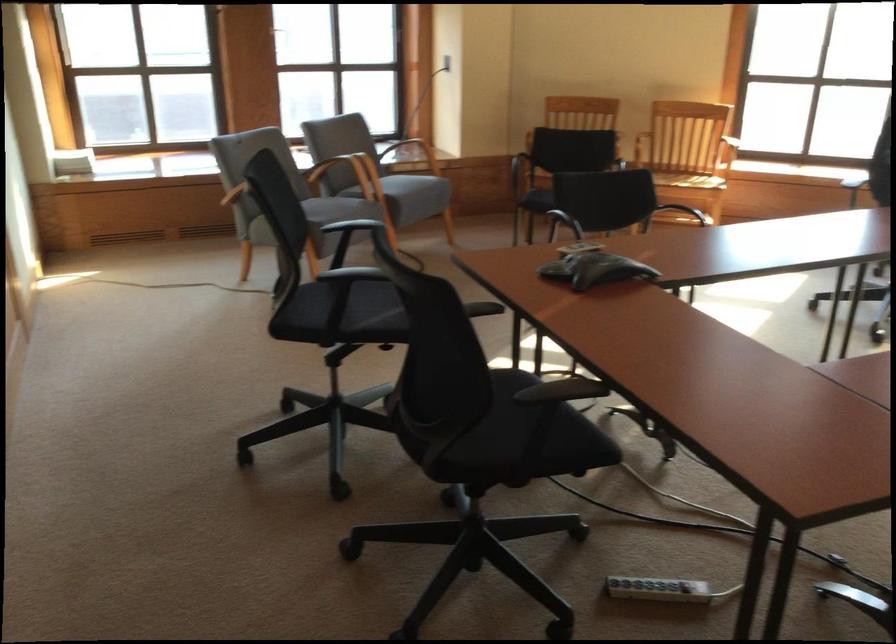
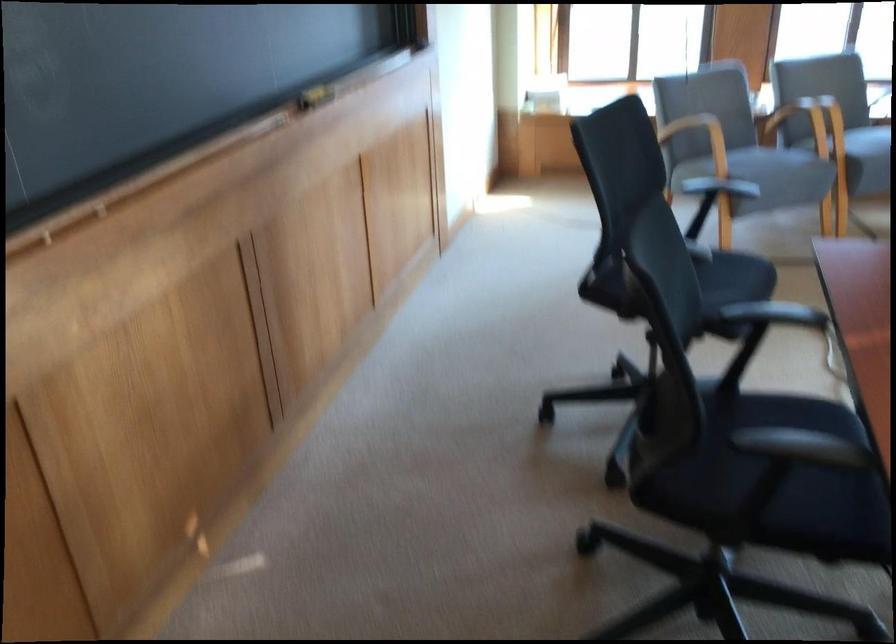
Question: I am providing you with two images of the same scene from different viewpoints. Please identify which objects are invisible in image2.

Choices:
 (A) black chair sitting surface
 (B) yellow board eraser
 (C) black coffee machine tray
 (D) black chair armrest

Answer: (D)